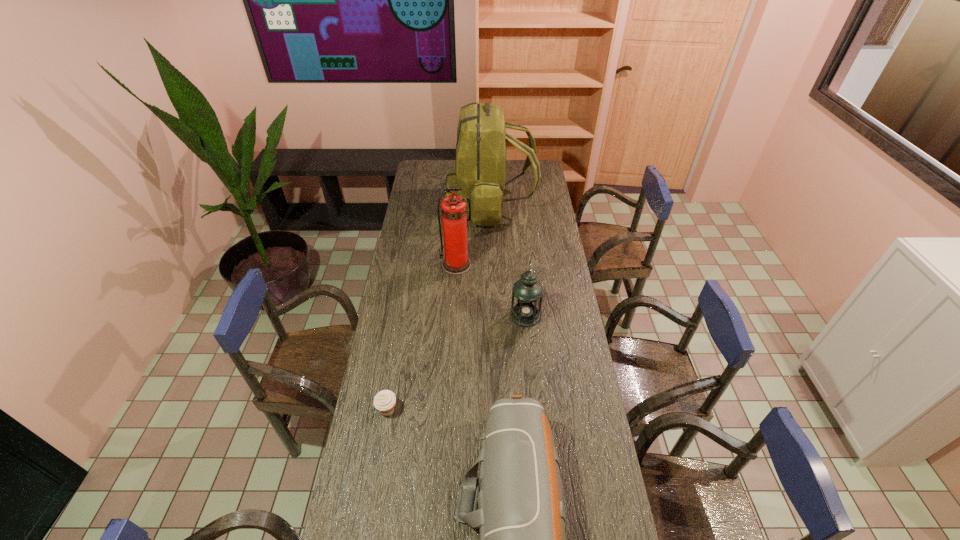
Find the location of a particular element. This screenshot has height=540, width=960. vacant point located on the front-facing side of the backpack is located at coordinates (416, 204).

At what (x,y) coordinates should I click in order to perform the action: click on vacant space positioned 0.080m at the discharge end of the second tallest object. Please return your answer as a coordinate pair (x, y). Looking at the image, I should click on (455, 287).

Identify the location of blank space located 0.240m on the back of the third nearest object. The width and height of the screenshot is (960, 540). (520, 267).

Image resolution: width=960 pixels, height=540 pixels. Find the location of `free space located on the right of the leftmost object`. free space located on the right of the leftmost object is located at coordinates (468, 410).

The image size is (960, 540). I want to click on object located in the far edge section of the desktop, so click(481, 145).

Find the location of a particular element. The width and height of the screenshot is (960, 540). object present at the left edge is located at coordinates (384, 401).

Identify the location of backpack present at the right edge. The image size is (960, 540). (481, 145).

Where is `oil lamp that is positioned at the right edge`? The image size is (960, 540). oil lamp that is positioned at the right edge is located at coordinates (527, 293).

Where is `object present at the far right corner`? Image resolution: width=960 pixels, height=540 pixels. object present at the far right corner is located at coordinates click(481, 145).

At what (x,y) coordinates should I click in order to perform the action: click on free location at the left edge of the desktop. Please return your answer as a coordinate pair (x, y). The image size is (960, 540). Looking at the image, I should click on (412, 194).